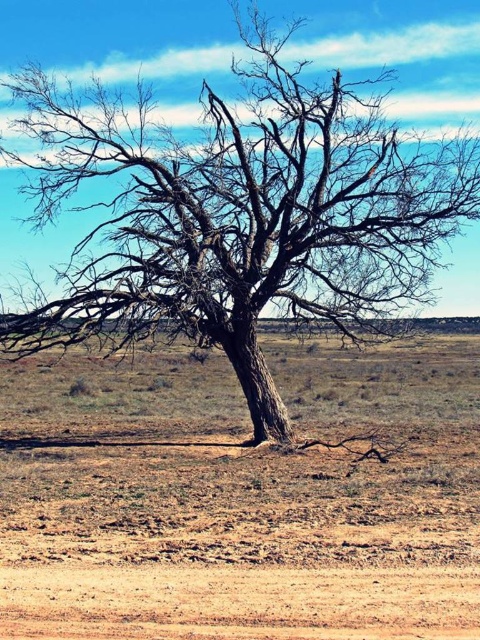
Question: Can you confirm if brown sandy soil at center is positioned to the right of dark brown bark tree at center?

Choices:
 (A) yes
 (B) no

Answer: (B)

Question: Is brown sandy soil at center below dark brown bark tree at center?

Choices:
 (A) no
 (B) yes

Answer: (B)

Question: Among these objects, which one is farthest from the camera?

Choices:
 (A) dark brown bark tree at center
 (B) brown sandy soil at center

Answer: (A)

Question: Which point appears closest to the camera in this image?

Choices:
 (A) (327, 612)
 (B) (338, 141)

Answer: (A)

Question: Is brown sandy soil at center above dark brown bark tree at center?

Choices:
 (A) no
 (B) yes

Answer: (A)